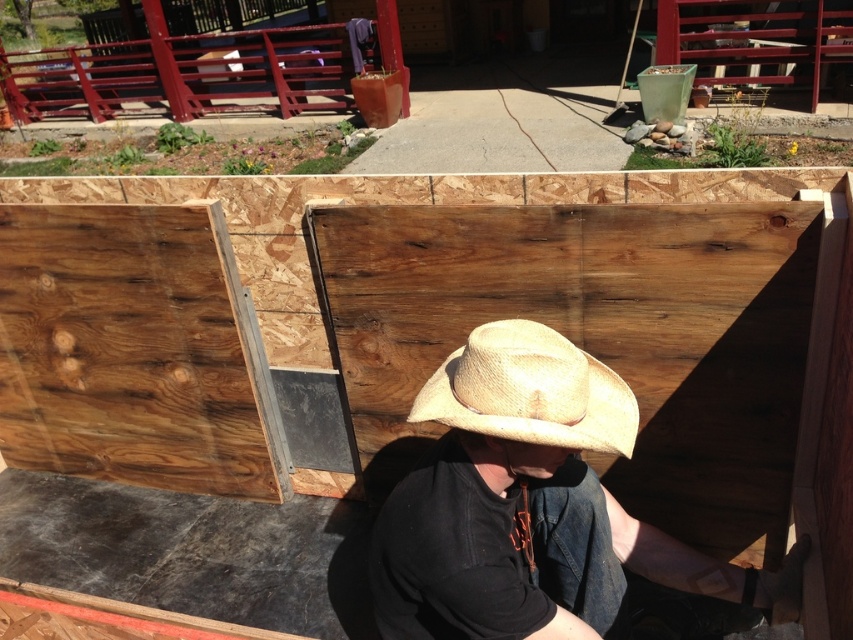
What do you see at coordinates (532, 506) in the screenshot? I see `straw hat at center` at bounding box center [532, 506].

Which is in front, point (555, 339) or point (519, 353)?

Positioned in front is point (519, 353).

Locate an element on the screen. straw hat at center is located at coordinates (532, 506).

Does natural wood board at center lie behind strawmaterial/texture cowboy hat at center?

Yes, natural wood board at center is further from the viewer.

Between natural wood board at center and strawmaterial/texture cowboy hat at center, which one is positioned higher?

strawmaterial/texture cowboy hat at center

This screenshot has height=640, width=853. Describe the element at coordinates (129, 349) in the screenshot. I see `natural wood board at center` at that location.

What are the coordinates of `natural wood board at center` in the screenshot? It's located at (129, 349).

Which of these two, straw hat at center or natural wood board at center, stands taller?

Standing taller between the two is natural wood board at center.

The image size is (853, 640). I want to click on straw hat at center, so click(532, 506).

At what (x,y) coordinates should I click in order to perform the action: click on straw hat at center. Please return your answer as a coordinate pair (x, y). The image size is (853, 640). Looking at the image, I should click on [x=532, y=506].